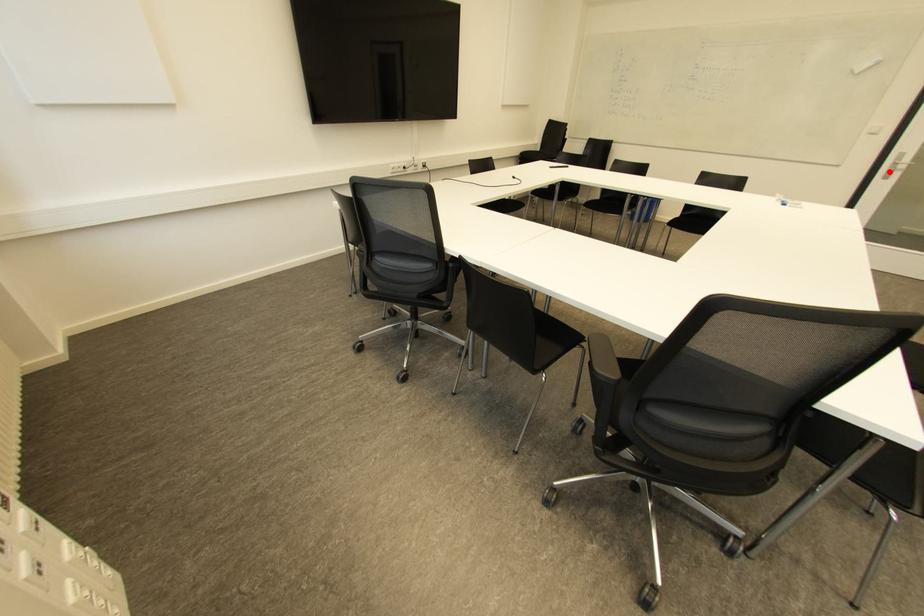
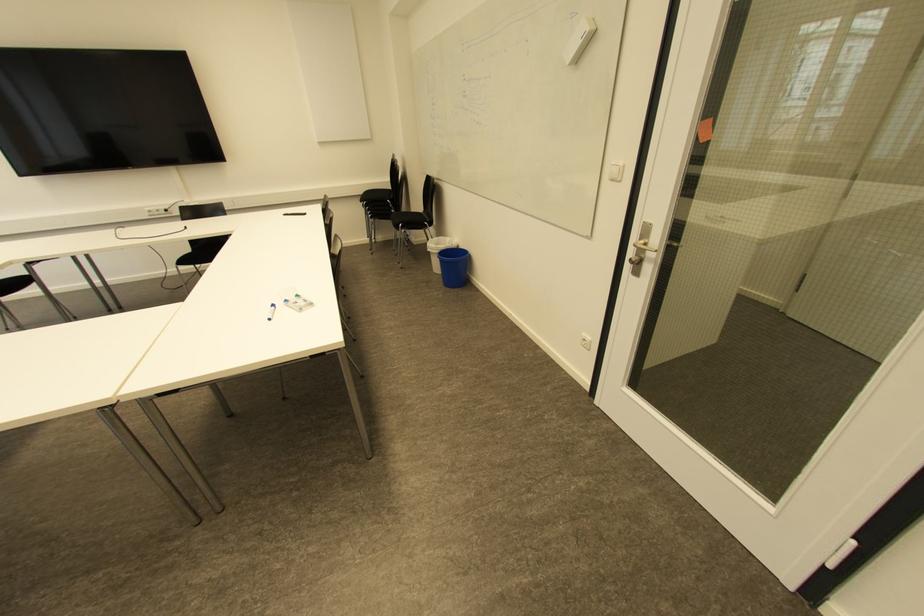
Question: A red point is marked in image1. In image2, is the corresponding 3D point closer to the camera or farther? Reply with the corresponding letter.

Choices:
 (A) The corresponding 3D point is closer.
 (B) The corresponding 3D point is farther.

Answer: (A)